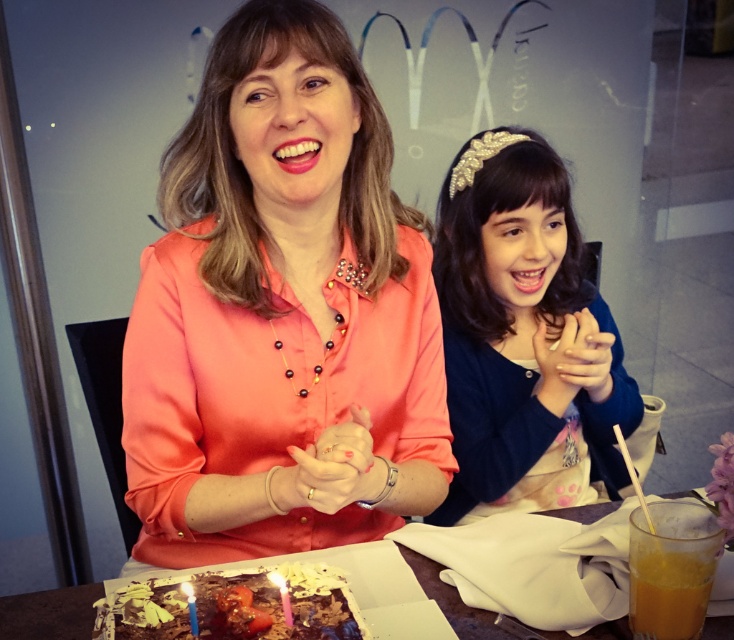
In the scene shown: You are a customer at McDonalds and want to blow out the matte yellow candle at lower left. Which direction should you move your hand to extinguish it, considering the position of the chocolatesmoothcake at lower center?

Since the chocolatesmoothcake at lower center is to the left of the matte yellow candle at lower left, you should move your hand to the right to blow out the matte yellow candle at lower left.

You are a delivery person who needs to place a small package between the matte gold headband at center and the blue wax candle at lower left. The package is 75 centimeters long. Will it fit in the space between them?

The distance between the matte gold headband at center and the blue wax candle at lower left is 77.82 centimeters. Since the package is 75 centimeters long, it will fit with about 2.82 centimeters of space remaining.